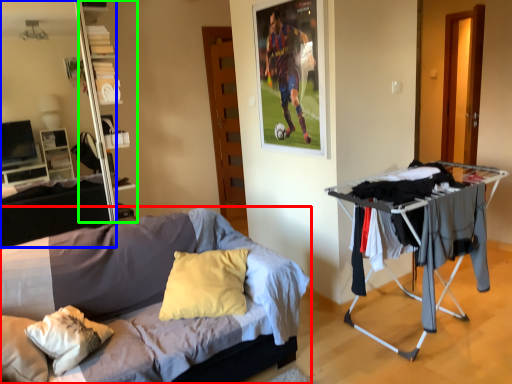
Question: Estimate the real-world distances between objects in this image. Which object is closer to bed (highlighted by a red box), entertainment center (highlighted by a blue box) or shelf (highlighted by a green box)?

Choices:
 (A) entertainment center
 (B) shelf

Answer: (B)